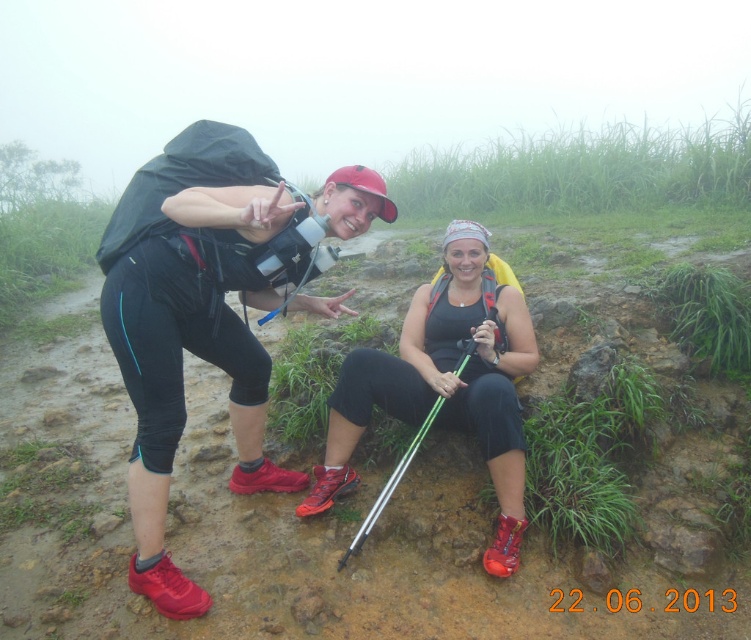
Does matte black backpack at left appear on the right side of green metallic ski pole at lower center?

No, matte black backpack at left is not to the right of green metallic ski pole at lower center.

You are a GUI agent. You are given a task and a screenshot of the screen. Output one action in this format:
    pyautogui.click(x=<x>, y=<y>)
    Task: Click on the matte black backpack at left
    
    Given the screenshot: What is the action you would take?
    pyautogui.click(x=213, y=337)

Does point (176, 401) come farther from viewer compared to point (463, 364)?

No, it is in front of (463, 364).

The width and height of the screenshot is (751, 640). In order to click on matte black backpack at left in this screenshot , I will do `click(213, 337)`.

Can you confirm if matte black backpack at left is bigger than matte black tank top at center?

Yes.

Does matte black backpack at left have a smaller size compared to matte black tank top at center?

Incorrect, matte black backpack at left is not smaller in size than matte black tank top at center.

Is point (347, 444) more distant than point (442, 364)?

No, (347, 444) is closer to viewer.

What are the coordinates of `matte black backpack at left` in the screenshot? It's located at (213, 337).

In the scene shown: Is matte black tank top at center further to the viewer compared to green metallic ski pole at lower center?

That is False.

Does matte black tank top at center have a greater height compared to green metallic ski pole at lower center?

Yes, matte black tank top at center is taller than green metallic ski pole at lower center.

Between point (409, 356) and point (366, 525), which one is positioned behind?

Point (409, 356)

Identify the location of matte black tank top at center. (445, 381).